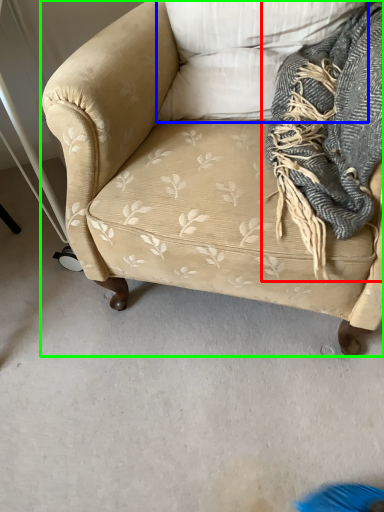
Question: Which object is the closest to the scarf (highlighted by a red box)? Choose among these: pillow (highlighted by a blue box) or studio couch (highlighted by a green box).

Choices:
 (A) pillow
 (B) studio couch

Answer: (A)